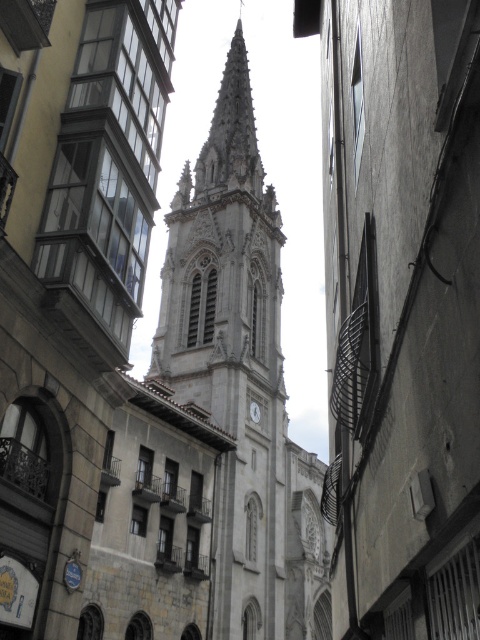
You are standing on the narrow street looking towards the church tower. You see the white stone tower at center and the white glossy clock at center. Which object is positioned higher in the image?

The white stone tower at center is positioned higher than the white glossy clock at center in the image.

You are a tourist in this European street and want to take a photo of both the white stone tower at center and the white glossy clock at center. Since you want to include both in the frame, which object should you focus on to ensure both are visible?

You should focus on the white stone tower at center because its width is larger than the white glossy clock at center, making it easier to frame both in the photo.